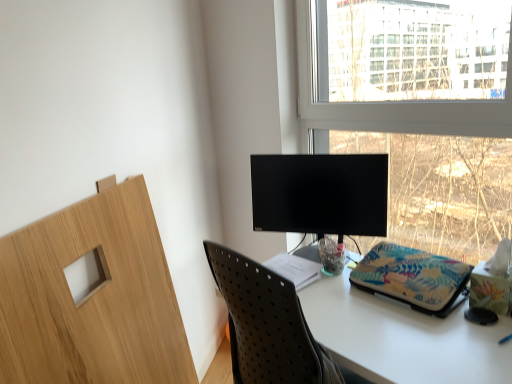
What are the coordinates of `free spot to the right of white paper at center` in the screenshot? It's located at (333, 283).